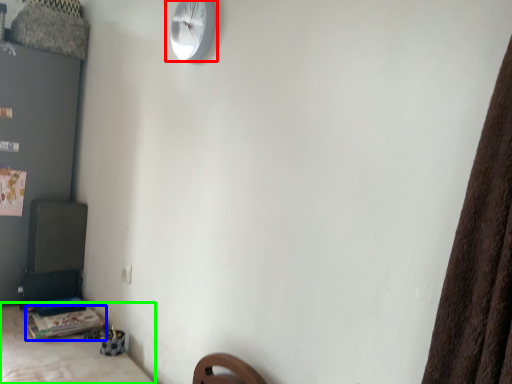
Question: Estimate the real-world distances between objects in this image. Which object is closer to wall clock (highlighted by a red box), table (highlighted by a blue box) or furniture (highlighted by a green box)?

Choices:
 (A) table
 (B) furniture

Answer: (B)